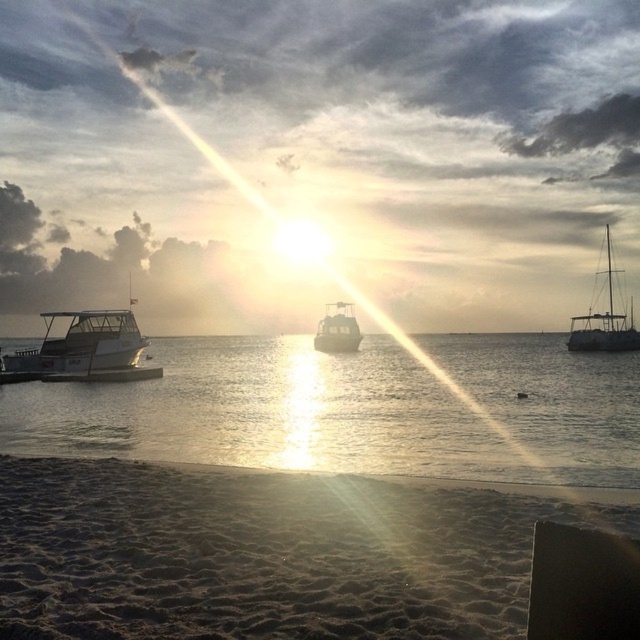
You are standing on the sandy beach at lower left and want to walk to the clear water at lower left. Which direction should you move to reach the water first?

Since the sandy beach at lower left is narrower than the clear water at lower left, you should move towards the direction where the sandy beach ends. This would be towards the right or left depending on the layout, but based on the description, moving towards the wider area of clear water might be the path. However, the exact direction isn

You are a photographer trying to capture the sunset with both the metallic silver boat at left and the metallic silver boat at center in your shot. Which boat will appear taller in your photo?

The metallic silver boat at left will appear taller in the photo because it is much taller than the metallic silver boat at center according to the description.